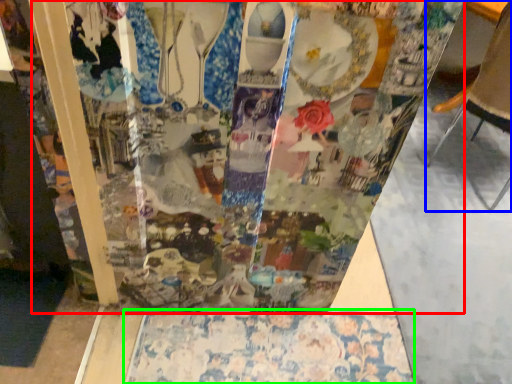
Question: Which object is positioned farthest from glass box (highlighted by a red box)? Select from furniture (highlighted by a blue box) and tablecloth (highlighted by a green box).

Choices:
 (A) furniture
 (B) tablecloth

Answer: (A)